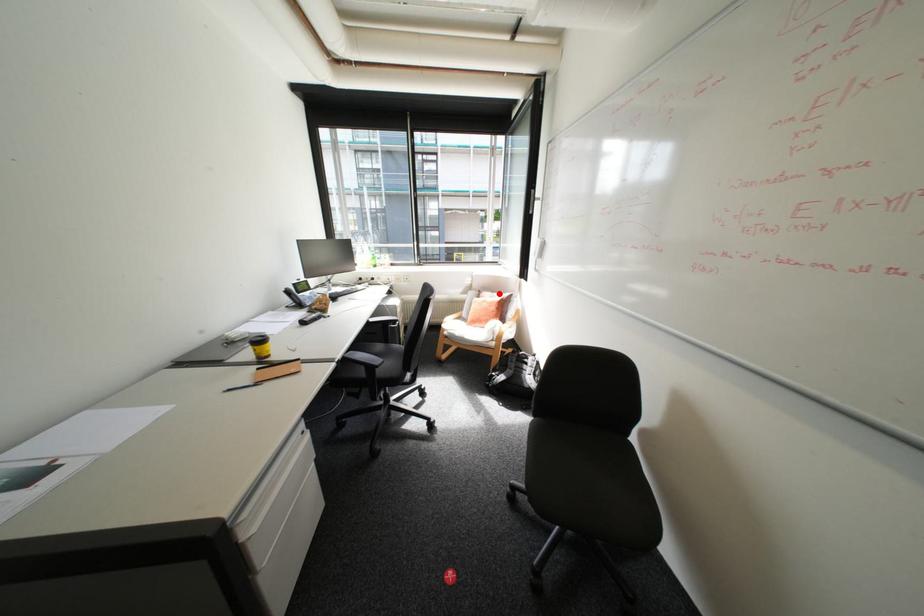
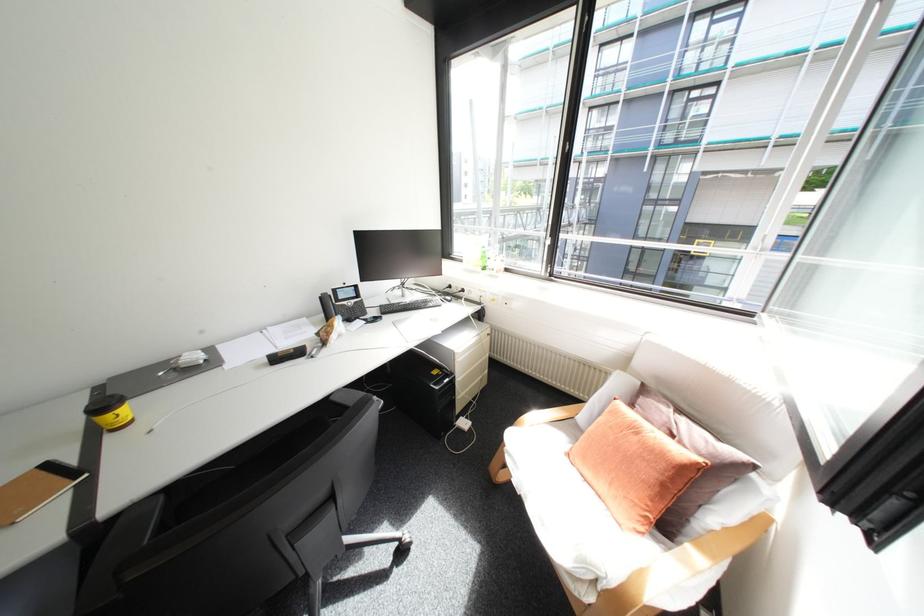
Locate, in the second image, the point that corresponds to the highlighted location in the first image.

(677, 410)